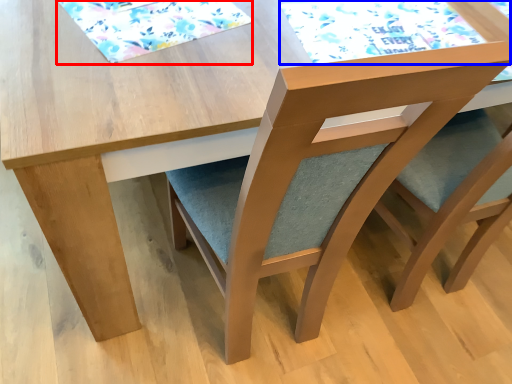
Question: Among these objects, which one is nearest to the camera, mat (highlighted by a red box) or mat (highlighted by a blue box)?

Choices:
 (A) mat
 (B) mat

Answer: (A)